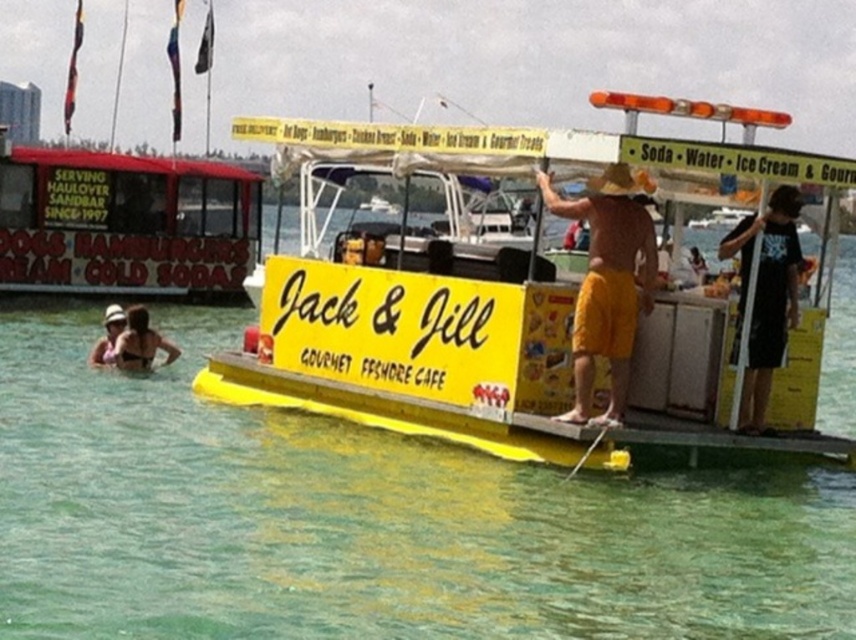
You are standing on the Jack and Jill Gourmet Freshore Cafe platform and want to walk to the clear water at center located at point (367, 518). Is there an unobstructed path from your current position to that point?

The clear water at center is located at point (367, 518), so yes, there is an unobstructed path from your current position on the Jack and Jill Gourmet Freshore Cafe platform to that point.

You are standing at the waterfront and want to reach the point marked at coordinates (179, 465). If your walking speed is 3 feet per second, how long will it take you to reach that point?

The distance between you and the point marked at coordinates (179, 465) is 38.38 feet. At a walking speed of 3 feet per second, it will take approximately 12.79 seconds to reach the point.